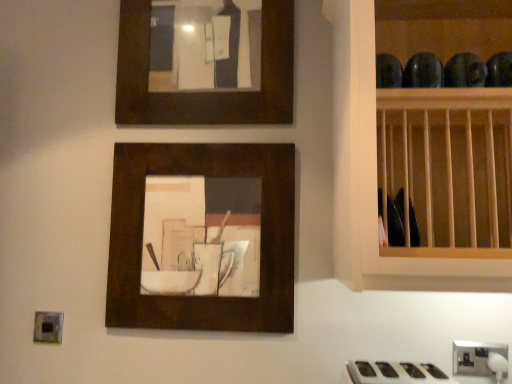
Question: Does matte wood picture frame at center, which is counted as the 1th picture frame, starting from the bottom, have a lesser height compared to matte brown picture frame at upper center, which ranks as the second picture frame in bottom-to-top order?

Choices:
 (A) yes
 (B) no

Answer: (B)

Question: Does matte wood picture frame at center, which is counted as the 1th picture frame, starting from the bottom, touch matte brown picture frame at upper center, which ranks as the second picture frame in bottom-to-top order?

Choices:
 (A) no
 (B) yes

Answer: (A)

Question: From a real-world perspective, is matte wood picture frame at center, arranged as the 2th picture frame when viewed from the top, below matte brown picture frame at upper center, which ranks as the second picture frame in bottom-to-top order?

Choices:
 (A) no
 (B) yes

Answer: (B)

Question: Is matte wood picture frame at center, arranged as the 2th picture frame when viewed from the top, to the left of matte brown picture frame at upper center, the 1th picture frame from the top, from the viewer's perspective?

Choices:
 (A) yes
 (B) no

Answer: (A)

Question: Does matte wood picture frame at center, which is counted as the 1th picture frame, starting from the bottom, have a greater width compared to matte brown picture frame at upper center, the 1th picture frame from the top?

Choices:
 (A) no
 (B) yes

Answer: (A)

Question: Considering the relative sizes of matte wood picture frame at center, arranged as the 2th picture frame when viewed from the top, and matte brown picture frame at upper center, which ranks as the second picture frame in bottom-to-top order, in the image provided, is matte wood picture frame at center, arranged as the 2th picture frame when viewed from the top, thinner than matte brown picture frame at upper center, which ranks as the second picture frame in bottom-to-top order,?

Choices:
 (A) yes
 (B) no

Answer: (A)

Question: Is satin silver outlet at lower right positioned in front of matte brown picture frame at upper center, the 1th picture frame from the top?

Choices:
 (A) no
 (B) yes

Answer: (B)

Question: Would you consider satin silver outlet at lower right to be distant from matte brown picture frame at upper center, the 1th picture frame from the top?

Choices:
 (A) no
 (B) yes

Answer: (B)

Question: From a real-world perspective, does satin silver outlet at lower right stand above matte brown picture frame at upper center, which ranks as the second picture frame in bottom-to-top order?

Choices:
 (A) no
 (B) yes

Answer: (A)

Question: Is satin silver outlet at lower right directly adjacent to matte brown picture frame at upper center, which ranks as the second picture frame in bottom-to-top order?

Choices:
 (A) no
 (B) yes

Answer: (A)

Question: Does satin silver outlet at lower right have a lesser height compared to matte brown picture frame at upper center, the 1th picture frame from the top?

Choices:
 (A) yes
 (B) no

Answer: (A)

Question: Is satin silver outlet at lower right further to the viewer compared to matte brown picture frame at upper center, the 1th picture frame from the top?

Choices:
 (A) yes
 (B) no

Answer: (B)

Question: Is matte brown picture frame at upper center, the 1th picture frame from the top, thinner than matte wood picture frame at center, which is counted as the 1th picture frame, starting from the bottom?

Choices:
 (A) no
 (B) yes

Answer: (A)